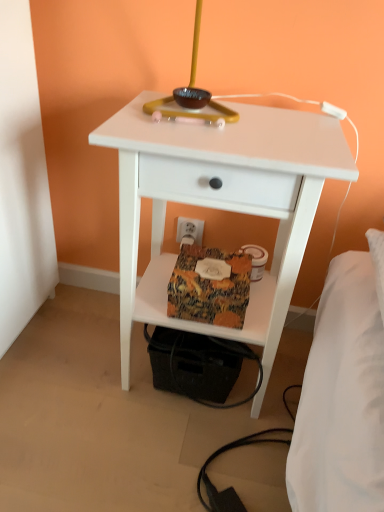
Where is `vacant area that is in front of white matte nightstand at center`? vacant area that is in front of white matte nightstand at center is located at coordinates (166, 460).